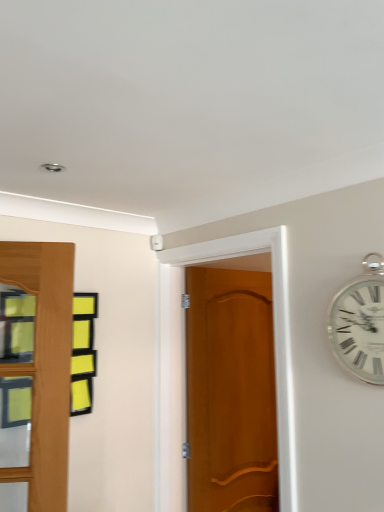
Question: Considering the positions of silver metallic clock at upper right and wooden door at center in the image, is silver metallic clock at upper right bigger or smaller than wooden door at center?

Choices:
 (A) small
 (B) big

Answer: (A)

Question: Relative to wooden door at center, is silver metallic clock at upper right in front or behind?

Choices:
 (A) behind
 (B) front

Answer: (B)

Question: Is silver metallic clock at upper right inside or outside of wooden door at center?

Choices:
 (A) inside
 (B) outside

Answer: (B)

Question: From their relative heights in the image, would you say wooden door at center is taller or shorter than silver metallic clock at upper right?

Choices:
 (A) short
 (B) tall

Answer: (B)

Question: Is wooden door at center in front of or behind silver metallic clock at upper right in the image?

Choices:
 (A) front
 (B) behind

Answer: (B)

Question: In terms of size, does wooden door at center appear bigger or smaller than silver metallic clock at upper right?

Choices:
 (A) small
 (B) big

Answer: (B)

Question: Which is correct: wooden door at center is inside silver metallic clock at upper right, or outside of it?

Choices:
 (A) outside
 (B) inside

Answer: (A)